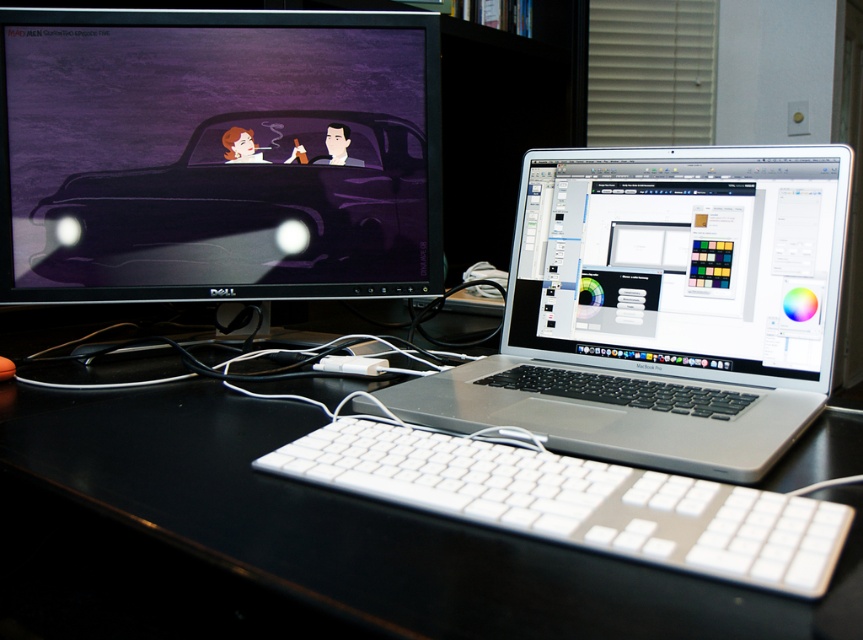
Looking at this image, does black glossy computer desk at center appear on the right side of silver metallic laptop at center?

In fact, black glossy computer desk at center is to the left of silver metallic laptop at center.

Is black glossy computer desk at center further to the viewer compared to silver metallic laptop at center?

No, it is not.

I want to click on black glossy computer desk at center, so click(306, 541).

Find the location of `black glossy computer desk at center`. black glossy computer desk at center is located at coordinates coord(306,541).

Is point (190, 465) in front of point (760, 173)?

That is True.

Find the location of a particular element. black glossy computer desk at center is located at coordinates (306, 541).

Where is `black glossy computer desk at center`? This screenshot has height=640, width=863. black glossy computer desk at center is located at coordinates coord(306,541).

Which of these two, satin silver laptop at center or white plastic keyboard at center, stands shorter?

white plastic keyboard at center is shorter.

What do you see at coordinates (682, 257) in the screenshot? I see `satin silver laptop at center` at bounding box center [682, 257].

Locate an element on the screen. This screenshot has width=863, height=640. satin silver laptop at center is located at coordinates (682, 257).